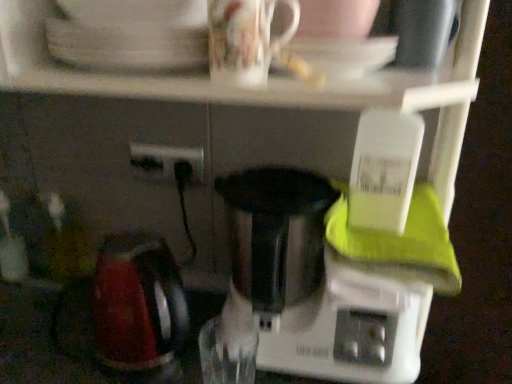
Question: Looking at their shapes, would you say black plastic power plugs and sockets at center is wider or thinner than white glossy saucer at upper center?

Choices:
 (A) thin
 (B) wide

Answer: (A)

Question: From a real-world perspective, relative to white glossy saucer at upper center, is black plastic power plugs and sockets at center vertically above or below?

Choices:
 (A) below
 (B) above

Answer: (A)

Question: Estimate the real-world distances between objects in this image. Which object is closer to the black plastic power plugs and sockets at center?

Choices:
 (A) white plastic mixer at center
 (B) white glossy saucer at upper center
 (C) glossy ceramic mug at upper center

Answer: (A)

Question: Which is farther from the white plastic mixer at center?

Choices:
 (A) white glossy saucer at upper center
 (B) black plastic power plugs and sockets at center
 (C) glossy ceramic mug at upper center

Answer: (C)